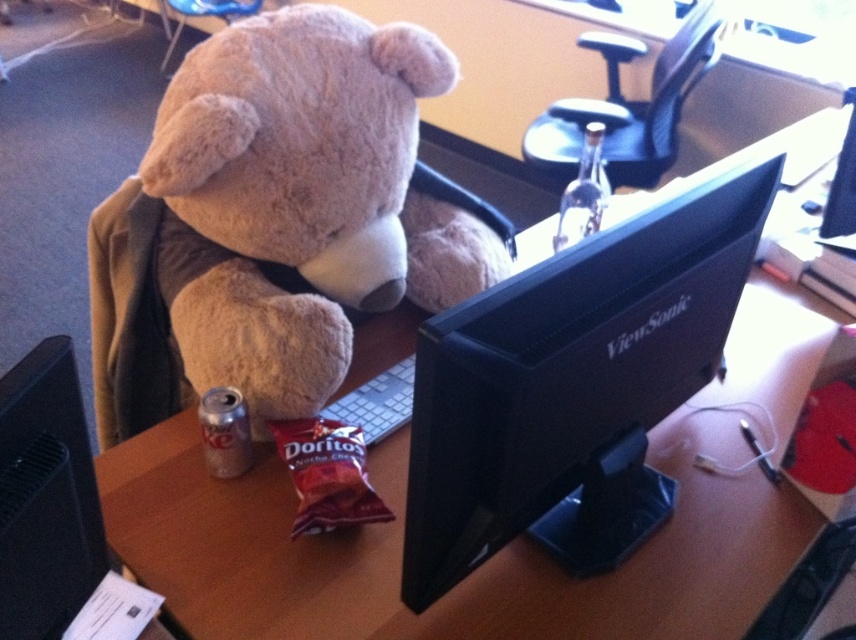
Question: Which of the following is the farthest from the observer?

Choices:
 (A) soft plush teddy bear at left
 (B) black matte viewsonic monitor at center
 (C) wooden at left

Answer: (A)

Question: In this image, where is soft plush teddy bear at left located relative to black matte viewsonic monitor at center?

Choices:
 (A) right
 (B) left

Answer: (B)

Question: Among these objects, which one is farthest from the camera?

Choices:
 (A) black matte viewsonic monitor at center
 (B) soft plush teddy bear at left
 (C) wooden at left
 (D) black mesh swivel chair at upper right

Answer: (D)

Question: Which of these objects is positioned closest to the soft plush teddy bear at left?

Choices:
 (A) black matte viewsonic monitor at center
 (B) wooden at left

Answer: (B)

Question: Can you confirm if soft plush teddy bear at left is positioned to the right of black mesh swivel chair at upper right?

Choices:
 (A) yes
 (B) no

Answer: (B)

Question: Is soft plush teddy bear at left to the left of black matte viewsonic monitor at center from the viewer's perspective?

Choices:
 (A) no
 (B) yes

Answer: (B)